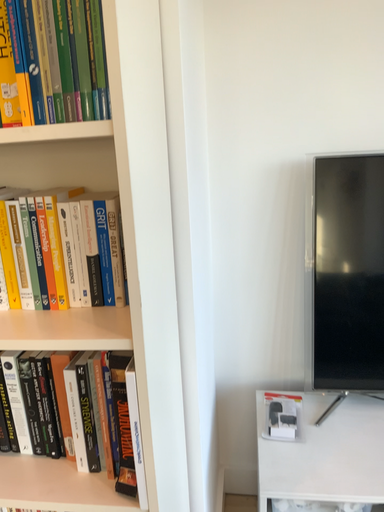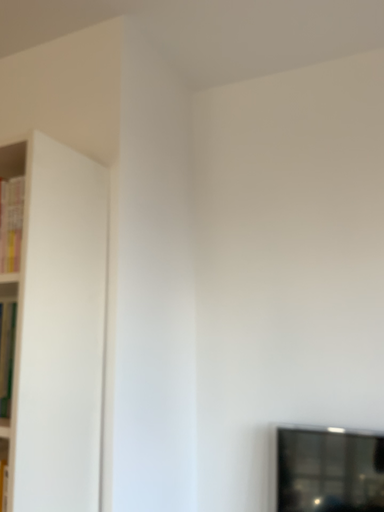
Question: How did the camera likely rotate when shooting the video?

Choices:
 (A) rotated downward
 (B) rotated upward

Answer: (B)